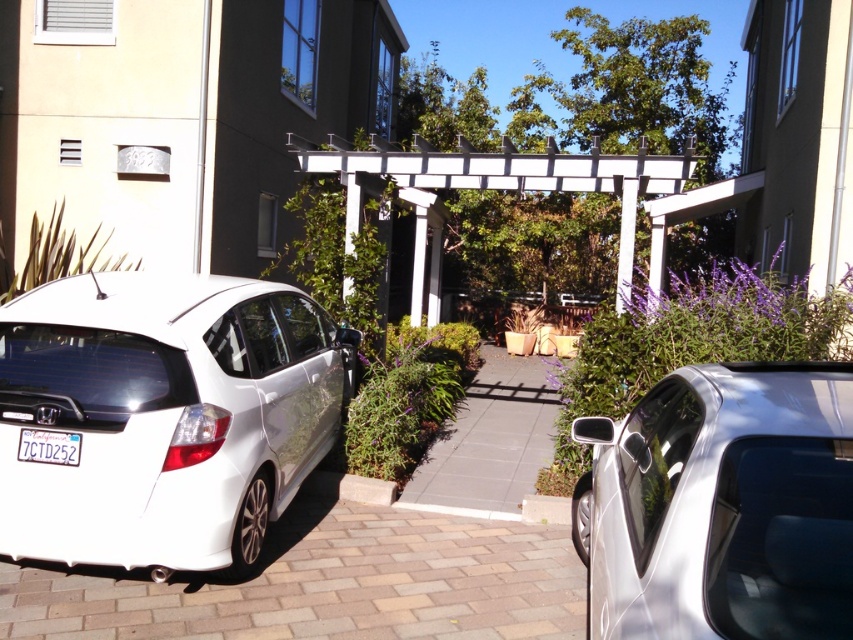
Between satin silver car at lower left and gray concrete driveway at center, which one appears on the left side from the viewer's perspective?

From the viewer's perspective, gray concrete driveway at center appears more on the left side.

Between satin silver car at lower left and gray concrete driveway at center, which one is positioned lower?

Positioned lower is gray concrete driveway at center.

Is point (729, 408) closer to camera compared to point (471, 410)?

Yes, point (729, 408) is in front of point (471, 410).

Identify the location of satin silver car at lower left. This screenshot has width=853, height=640. (721, 506).

Who is lower down, white glossy hatchback at lower left or satin silver car at lower left?

satin silver car at lower left

This screenshot has height=640, width=853. What do you see at coordinates (164, 416) in the screenshot? I see `white glossy hatchback at lower left` at bounding box center [164, 416].

The image size is (853, 640). What are the coordinates of `white glossy hatchback at lower left` in the screenshot? It's located at (164, 416).

Is brick paved driveway at lower left bigger than white wood pergola at center?

No.

Who is more forward, [537,624] or [599,173]?

Point [537,624] is more forward.

Find the location of `brick paved driveway at lower left`. brick paved driveway at lower left is located at coordinates (325, 584).

Find the location of a particular element. The height and width of the screenshot is (640, 853). brick paved driveway at lower left is located at coordinates (325, 584).